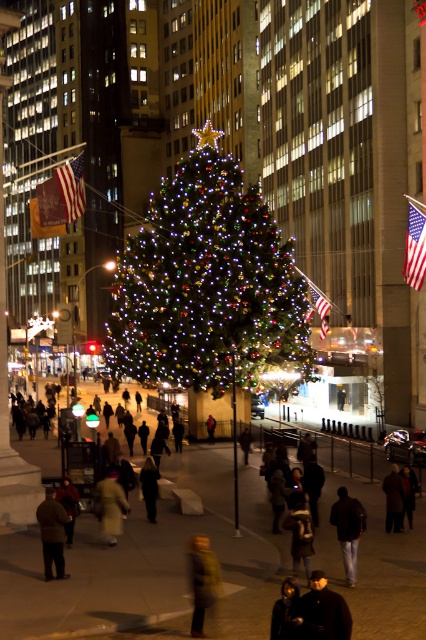
You are a photographer trying to capture a photo of the Christmas tree. You notice two people wearing coats in the foreground. The dark brown leather coat at lower center and the dark gray fabric jacket at center are blocking your view. Which coat should you move to get a clearer shot of the tree?

The dark brown leather coat at lower center is smaller than the dark gray fabric jacket at center. Moving the smaller dark brown leather coat at lower center would allow you to see the tree more clearly since it takes up less space.

You are a photographer standing in the plaza and want to take a photo of the illuminated glossy christmas tree at center and the yellow wool coat at center. Which object should you focus on first if you want to capture both in one frame without moving the camera?

The illuminated glossy christmas tree at center is larger in size compared to the yellow wool coat at center, so you should focus on the illuminated glossy christmas tree at center first to ensure it fits properly in the frame before adjusting for the smaller yellow wool coat at center.